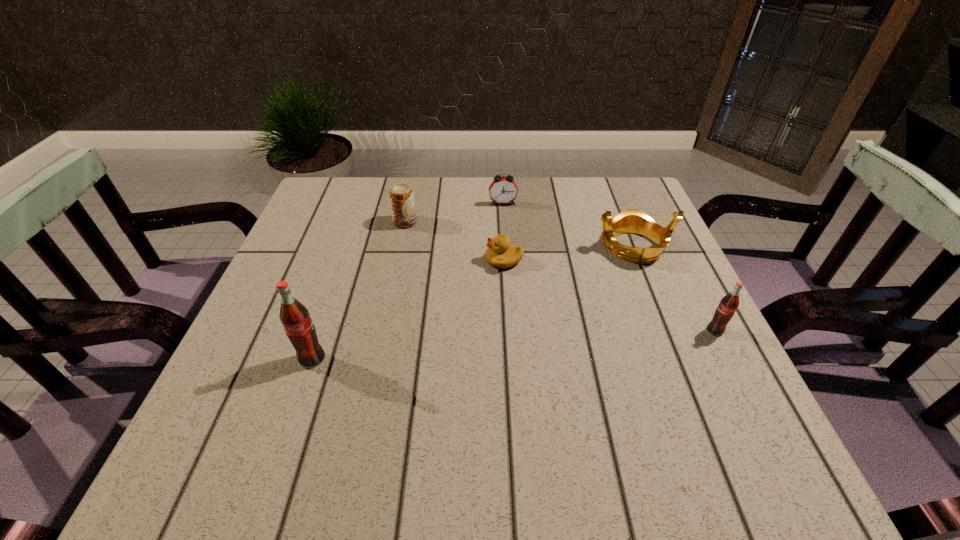
Where is `the left soda bottle`? This screenshot has width=960, height=540. the left soda bottle is located at coordinates (295, 318).

Find the location of a particular element. the nearest object is located at coordinates (295, 318).

Identify the location of the right soda bottle. (729, 303).

Identify the location of the second nearest object. (729, 303).

The image size is (960, 540). Identify the location of the farthest object. click(503, 190).

You are a GUI agent. You are given a task and a screenshot of the screen. Output one action in this format:
    pyautogui.click(x=<x>, y=<y>)
    Task: Click on the beer can
    The height and width of the screenshot is (540, 960).
    Given the screenshot: What is the action you would take?
    pyautogui.click(x=401, y=197)

Identify the location of tiara. Image resolution: width=960 pixels, height=540 pixels. (629, 221).

What are the coordinates of `the shortest object` in the screenshot? It's located at (500, 253).

This screenshot has height=540, width=960. In order to click on vacant space located on the label of the nearest object in this screenshot , I will do `click(292, 418)`.

This screenshot has height=540, width=960. I want to click on vacant space located on the label of the shorter soda bottle, so click(x=737, y=375).